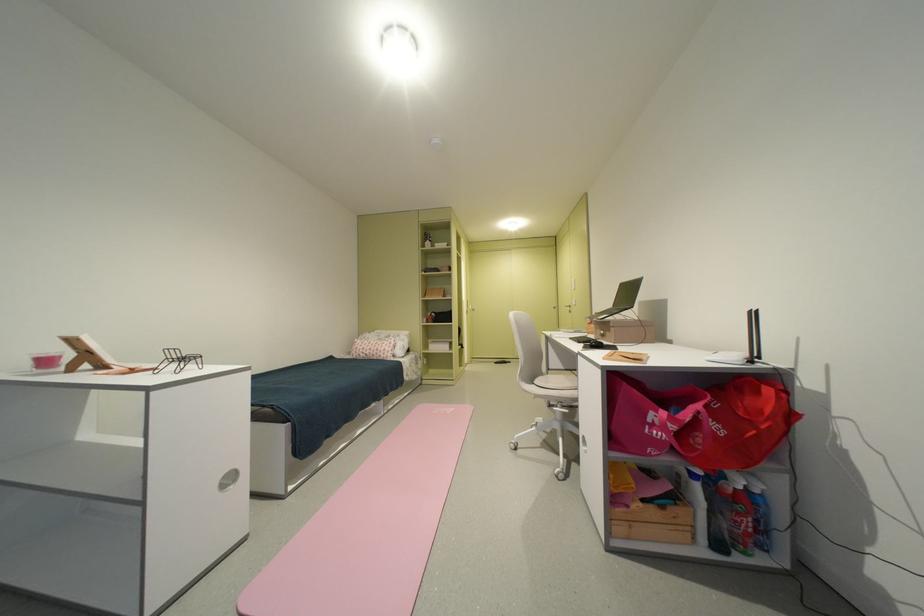
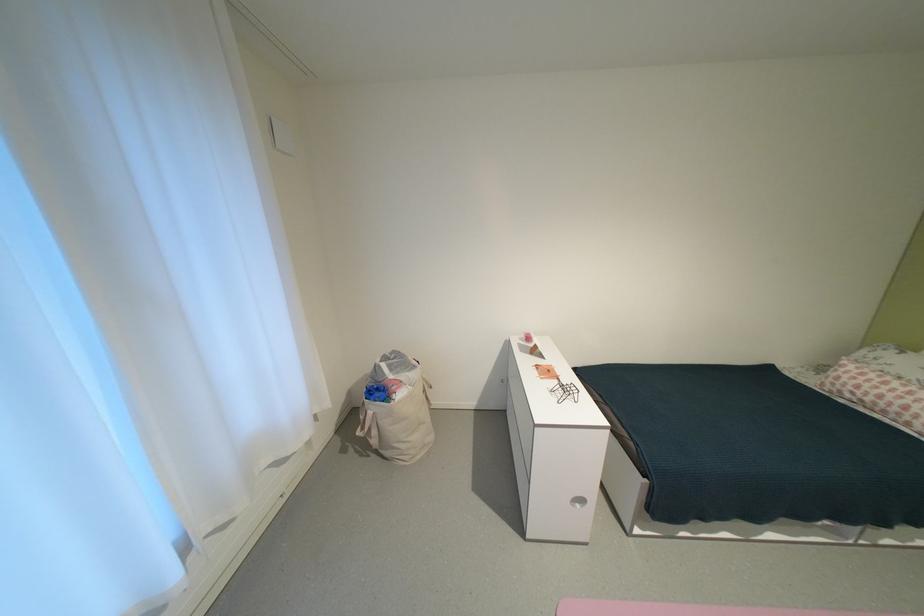
Find the pixel in the second image that matches (373,352) in the first image.

(867, 392)